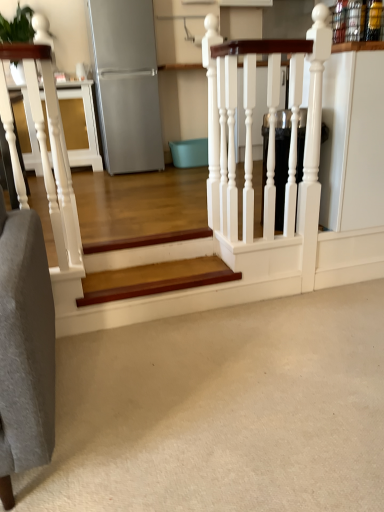
You are a GUI agent. You are given a task and a screenshot of the screen. Output one action in this format:
    pyautogui.click(x=<x>, y=<y>)
    Task: Click on the satin silver refrigerator at upper left
    The image size is (384, 512).
    Given the screenshot: What is the action you would take?
    pyautogui.click(x=127, y=84)

Which is nearer, [188,431] or [251,230]?

Positioned in front is point [188,431].

Considering the relative sizes of white carpet at lower center and white glossy rail at upper center in the image provided, is white carpet at lower center thinner than white glossy rail at upper center?

Incorrect, the width of white carpet at lower center is not less than that of white glossy rail at upper center.

From a real-world perspective, which is physically above, white carpet at lower center or white glossy rail at upper center?

white glossy rail at upper center.

Is white carpet at lower center positioned far away from white glossy rail at upper center?

No, there isn't a large distance between white carpet at lower center and white glossy rail at upper center.

Is wooden stair at center turned away from white carpet at lower center?

wooden stair at center is not turned away from white carpet at lower center.

Which is closer to the camera, (89, 285) or (160, 328)?

The point (160, 328) is more forward.

From a real-world perspective, is white carpet at lower center physically located above or below wooden stair at center?

Clearly, from a real-world perspective, white carpet at lower center is below wooden stair at center.

Considering the relative positions of white carpet at lower center and wooden stair at center in the image provided, is white carpet at lower center to the left of wooden stair at center from the viewer's perspective?

In fact, white carpet at lower center is to the right of wooden stair at center.

Locate an element on the screen. The width and height of the screenshot is (384, 512). stairs behind the white carpet at lower center is located at coordinates (154, 279).

Can you confirm if white carpet at lower center is taller than wooden stair at center?

No.

Is point (245, 258) closer to camera compared to point (122, 67)?

Yes, point (245, 258) is in front of point (122, 67).

Locate an element on the screen. rail in front of the satin silver refrigerator at upper left is located at coordinates (268, 151).

Is white glossy rail at upper center beside satin silver refrigerator at upper left?

white glossy rail at upper center is not next to satin silver refrigerator at upper left, and they're not touching.

Which is more to the right, white glossy rail at upper center or satin silver refrigerator at upper left?

From the viewer's perspective, white glossy rail at upper center appears more on the right side.

Which is closer, (126, 143) or (247, 73)?

The point (247, 73) is more forward.

From the image's perspective, would you say satin silver refrigerator at upper left is positioned over white glossy rail at upper center?

Yes, from the image's perspective, satin silver refrigerator at upper left is over white glossy rail at upper center.

Identify the location of appliance that is behind the white glossy rail at upper center. (127, 84).

From a real-world perspective, which is physically below, satin silver refrigerator at upper left or white glossy rail at upper center?

white glossy rail at upper center, from a real-world perspective.

From the image's perspective, is white glossy rail at upper center positioned above or below wooden stair at center?

white glossy rail at upper center is situated higher than wooden stair at center in the image.

Can we say white glossy rail at upper center lies outside wooden stair at center?

That's correct, white glossy rail at upper center is outside of wooden stair at center.

Is the depth of white glossy rail at upper center less than that of wooden stair at center?

Yes, it is in front of wooden stair at center.

Considering the sizes of objects wooden stair at center and satin silver refrigerator at upper left in the image provided, who is smaller, wooden stair at center or satin silver refrigerator at upper left?

With smaller size is wooden stair at center.

Looking at this image, measure the distance from wooden stair at center to satin silver refrigerator at upper left.

A distance of 6.42 feet exists between wooden stair at center and satin silver refrigerator at upper left.

Are wooden stair at center and satin silver refrigerator at upper left far apart?

wooden stair at center is positioned a significant distance from satin silver refrigerator at upper left.

Find the location of `rail behind the white carpet at lower center`. rail behind the white carpet at lower center is located at coordinates (268, 151).

The image size is (384, 512). What are the coordinates of `stairs above the white carpet at lower center (from a real-world perspective)` in the screenshot? It's located at (154, 279).

Based on their spatial positions, is white carpet at lower center or satin silver refrigerator at upper left further from white glossy rail at upper center?

satin silver refrigerator at upper left lies further to white glossy rail at upper center than the other object.

Looking at this image, based on their spatial positions, is satin silver refrigerator at upper left or white carpet at lower center further from white glossy rail at upper center?

satin silver refrigerator at upper left is further to white glossy rail at upper center.

Considering their positions, is white carpet at lower center positioned closer to satin silver refrigerator at upper left than wooden stair at center?

wooden stair at center is positioned closer to the anchor satin silver refrigerator at upper left.

Looking at the image, which one is located further to white glossy rail at upper center, white carpet at lower center or wooden stair at center?

white carpet at lower center.

Based on their spatial positions, is wooden stair at center or white carpet at lower center closer to satin silver refrigerator at upper left?

wooden stair at center.

When comparing their distances from white carpet at lower center, does white glossy rail at upper center or wooden stair at center seem closer?

wooden stair at center lies closer to white carpet at lower center than the other object.

When comparing their distances from white glossy rail at upper center, does wooden stair at center or satin silver refrigerator at upper left seem further?

Among the two, satin silver refrigerator at upper left is located further to white glossy rail at upper center.

Estimate the real-world distances between objects in this image. Which object is further from white carpet at lower center, satin silver refrigerator at upper left or wooden stair at center?

satin silver refrigerator at upper left is further to white carpet at lower center.

Find the location of a particular element. The height and width of the screenshot is (512, 384). rail located between white carpet at lower center and satin silver refrigerator at upper left in the depth direction is located at coordinates (268, 151).

At what (x,y) coordinates should I click in order to perform the action: click on rail between satin silver refrigerator at upper left and wooden stair at center in the up-down direction. Please return your answer as a coordinate pair (x, y). The image size is (384, 512). Looking at the image, I should click on (268, 151).

You are a GUI agent. You are given a task and a screenshot of the screen. Output one action in this format:
    pyautogui.click(x=<x>, y=<y>)
    Task: Click on the stairs positioned between white carpet at lower center and satin silver refrigerator at upper left from near to far
    
    Given the screenshot: What is the action you would take?
    pos(154,279)

At what (x,y) coordinates should I click in order to perform the action: click on rail between white carpet at lower center and wooden stair at center from front to back. Please return your answer as a coordinate pair (x, y). The height and width of the screenshot is (512, 384). Looking at the image, I should click on (268, 151).